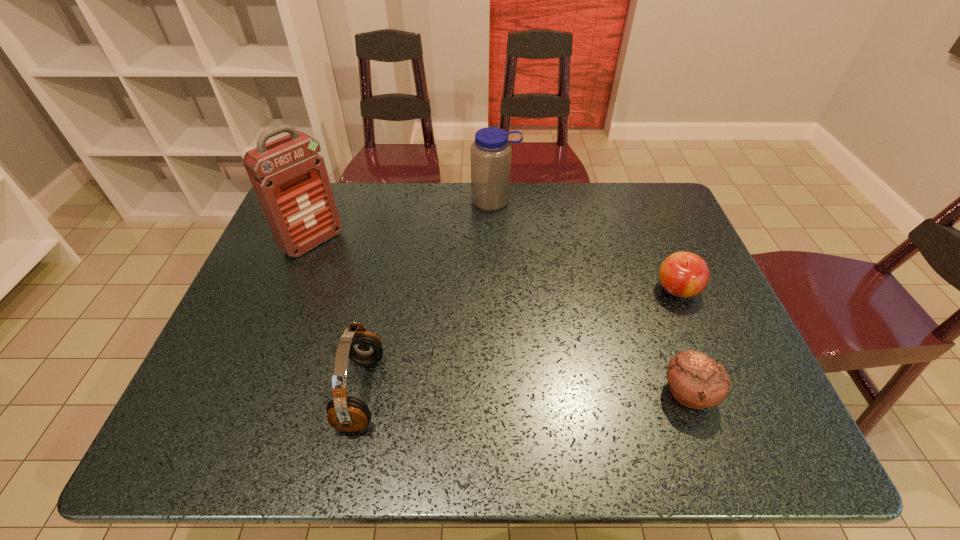
Identify the location of free location located on the ear cups of the fourth object from right to left. The height and width of the screenshot is (540, 960). (277, 392).

The image size is (960, 540). In order to click on free space located 0.070m on the right of the muffin in this screenshot , I will do `click(747, 393)`.

Where is `vacant space located 0.110m on the stem of the apple`? vacant space located 0.110m on the stem of the apple is located at coordinates (629, 314).

The height and width of the screenshot is (540, 960). I want to click on free space located 0.190m on the stem of the apple, so click(604, 327).

This screenshot has width=960, height=540. I want to click on free space located on the stem of the apple, so click(x=562, y=349).

Locate an element on the screen. blank space located on the front-facing side of the leftmost object is located at coordinates (x=419, y=326).

The image size is (960, 540). Find the location of `vacant space located 0.400m on the front-facing side of the leftmost object`. vacant space located 0.400m on the front-facing side of the leftmost object is located at coordinates click(x=424, y=330).

Where is `free space located on the front-facing side of the leftmost object`? free space located on the front-facing side of the leftmost object is located at coordinates (366, 284).

Locate an element on the screen. This screenshot has height=540, width=960. vacant region located with a carrying loop on the side of the third object from left to right is located at coordinates (496, 240).

I want to click on vacant position located 0.230m with a carrying loop on the side of the third object from left to right, so click(497, 264).